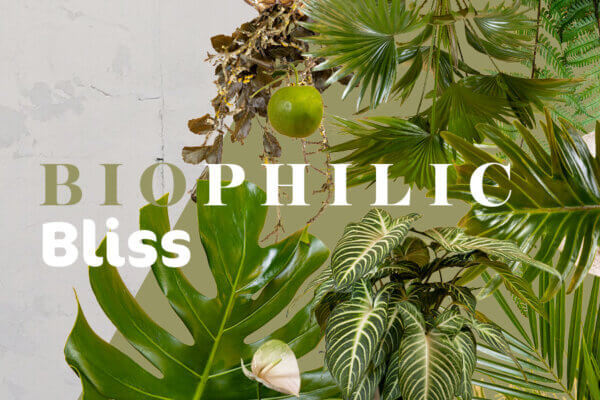
Find the location of `wall`. wall is located at coordinates (138, 106).